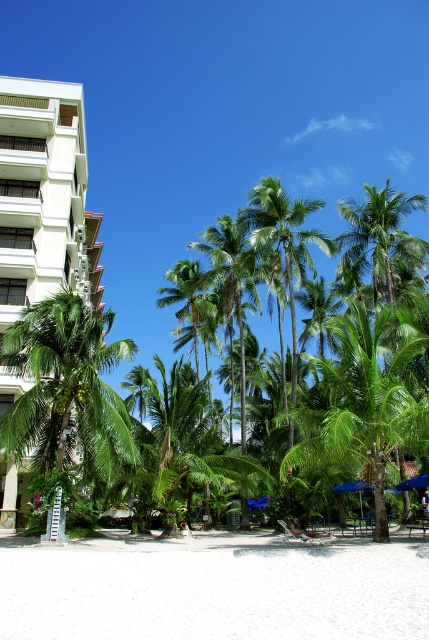
Is white smooth building at upper left closer to the viewer compared to green leafy palm tree at left?

No, white smooth building at upper left is behind green leafy palm tree at left.

Who is more forward, (11, 525) or (90, 470)?

Point (90, 470) is more forward.

What are the coordinates of `white smooth building at upper left` in the screenshot? It's located at (45, 196).

In the scene shown: Does white smooth building at upper left lie behind white plastic beach chair at center?

No, it is in front of white plastic beach chair at center.

Is white smooth building at upper left wider than white plastic beach chair at center?

Correct, the width of white smooth building at upper left exceeds that of white plastic beach chair at center.

Does point (0, 244) lie behind point (314, 532)?

That is True.

Where is `white smooth building at upper left`? This screenshot has height=640, width=429. white smooth building at upper left is located at coordinates (45, 196).

Is point (319, 554) farther from viewer compared to point (316, 544)?

No, (319, 554) is in front of (316, 544).

Identify the location of white sand beach at lower center. Image resolution: width=429 pixels, height=640 pixels. (214, 589).